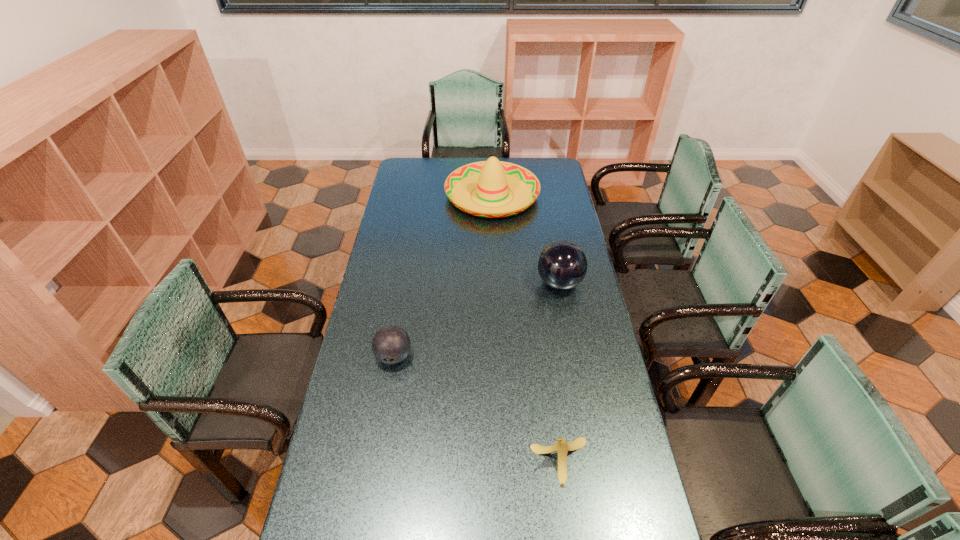
Find the location of a particular element. Image resolution: width=960 pixels, height=540 pixels. free spot located on the grip area of the nearer bowling ball is located at coordinates (x=388, y=391).

Identify the location of free point located on the left of the banana. The height and width of the screenshot is (540, 960). (419, 462).

Identify the location of object located at the far edge. Image resolution: width=960 pixels, height=540 pixels. (492, 178).

Image resolution: width=960 pixels, height=540 pixels. In order to click on object located at the left edge in this screenshot , I will do `click(391, 344)`.

Where is `sombrero that is positioned at the right edge`? This screenshot has height=540, width=960. sombrero that is positioned at the right edge is located at coordinates (492, 178).

Image resolution: width=960 pixels, height=540 pixels. In order to click on bowling ball situated at the right edge in this screenshot , I will do `click(562, 265)`.

Where is `banana located at the right edge`? banana located at the right edge is located at coordinates (562, 447).

Find the location of a particular element. object positioned at the far right corner is located at coordinates (492, 178).

In the image, there is a desktop. Where is `vacant space at the left edge`? vacant space at the left edge is located at coordinates (411, 278).

Where is `vacant position at the right edge of the desktop`? vacant position at the right edge of the desktop is located at coordinates (571, 241).